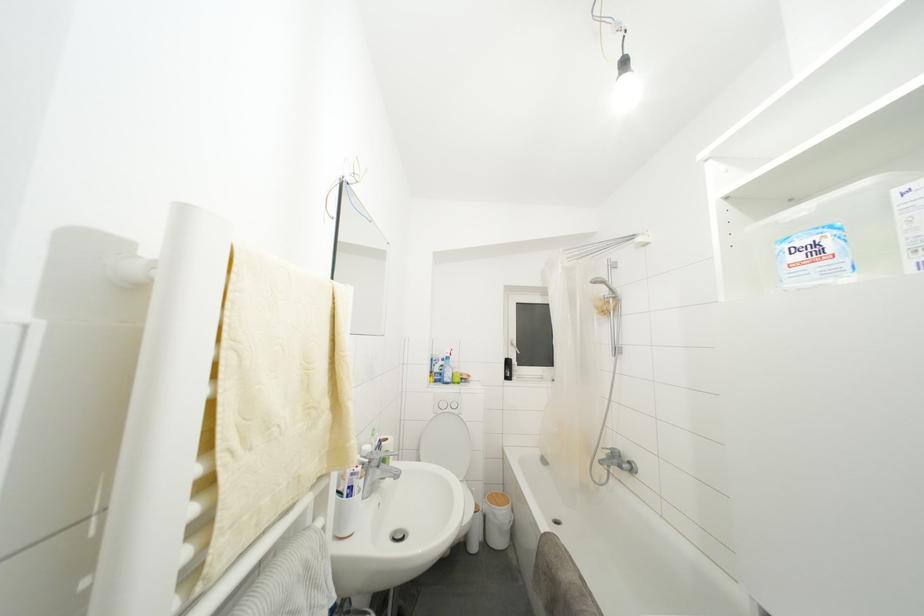
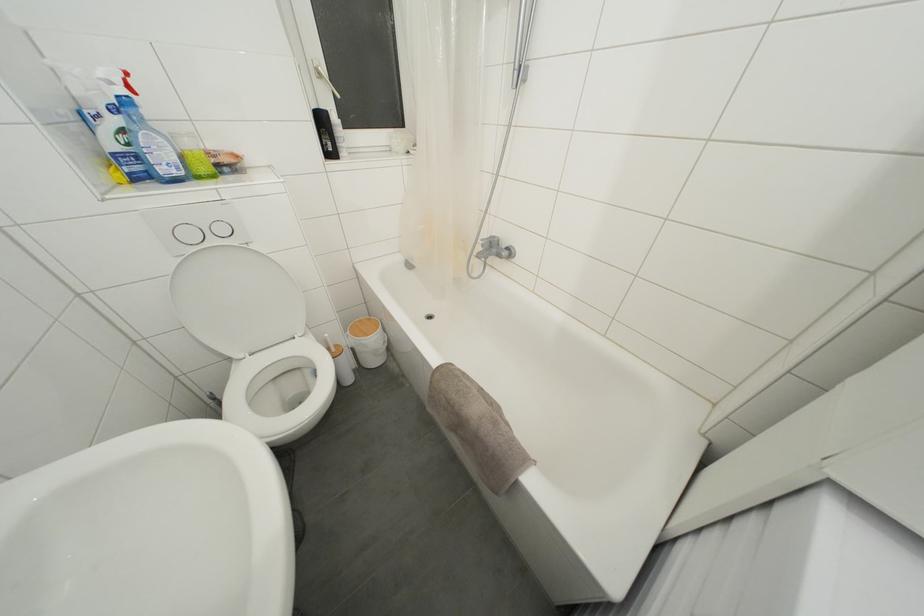
Locate, in the second image, the point that corresponds to point 447,410 in the first image.

(195, 240)